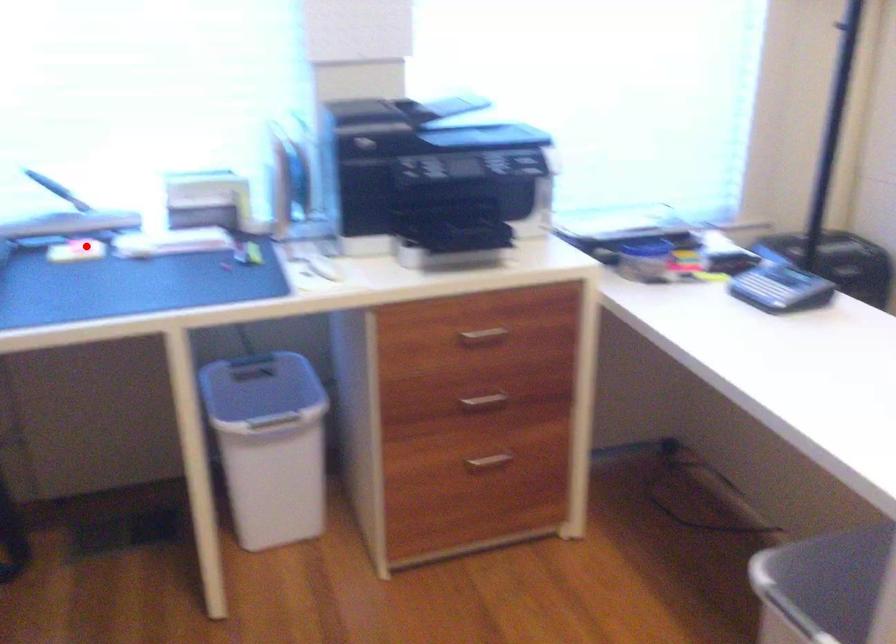
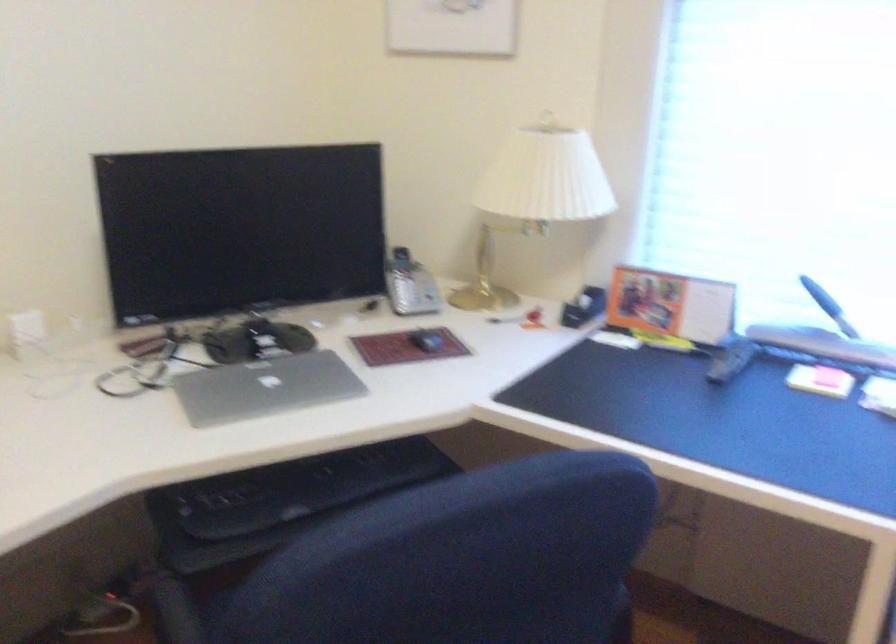
Locate, in the second image, the point that corresponds to the highlighted location in the first image.

(829, 377)